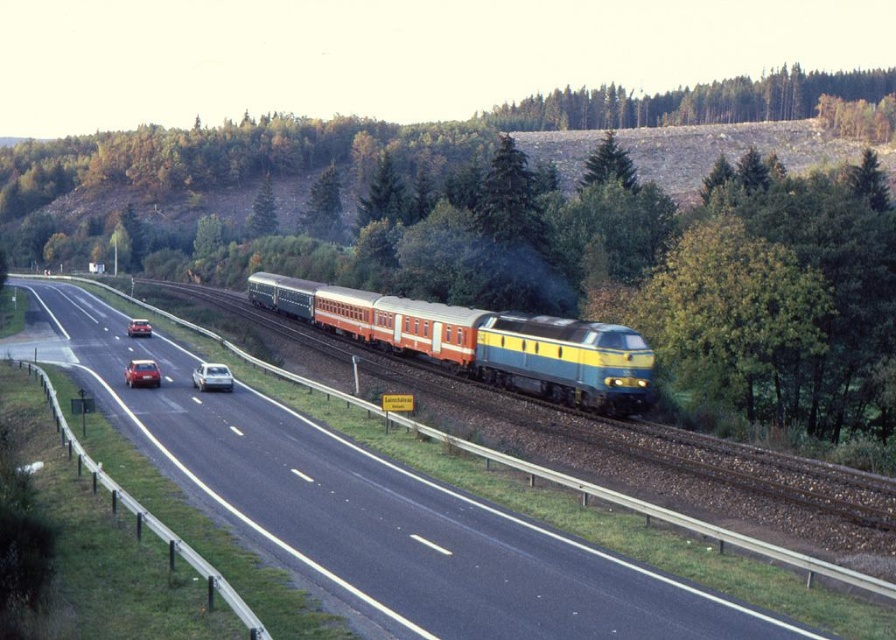
Does point (702, 118) come in front of point (141, 326)?

No, (702, 118) is behind (141, 326).

Who is more forward, [547,99] or [136,330]?

Point [136,330] is more forward.

Is point (666, 92) in front of point (145, 320)?

No, (666, 92) is further to viewer.

Locate an element on the screen. green leafy trees at upper center is located at coordinates (691, 100).

Between orange/yellow painted coach at center and shiny red sedan at left, which one appears on the right side from the viewer's perspective?

From the viewer's perspective, orange/yellow painted coach at center appears more on the right side.

Which is in front, point (597, 387) or point (130, 378)?

Point (597, 387) is in front.

Find the location of `orange/yellow painted coach at center`. orange/yellow painted coach at center is located at coordinates [481, 340].

Can you confirm if orange/yellow painted coach at center is thinner than matte red car at left?

In fact, orange/yellow painted coach at center might be wider than matte red car at left.

Can you confirm if orange/yellow painted coach at center is bigger than matte red car at left?

Yes, orange/yellow painted coach at center is bigger than matte red car at left.

Which is behind, point (630, 381) or point (142, 323)?

Point (142, 323)

Find the location of `orange/yellow painted coach at center`. orange/yellow painted coach at center is located at coordinates (481, 340).